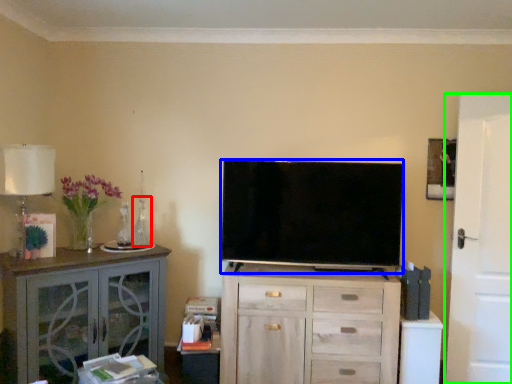
Question: Based on their relative distances, which object is farther from vase (highlighted by a red box)? Choose from television (highlighted by a blue box) and door (highlighted by a green box).

Choices:
 (A) television
 (B) door

Answer: (B)